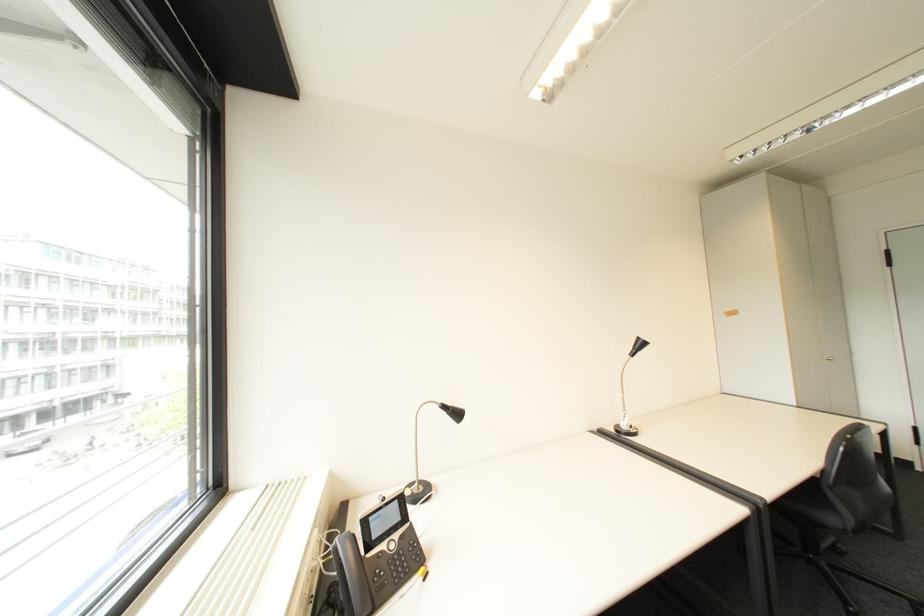
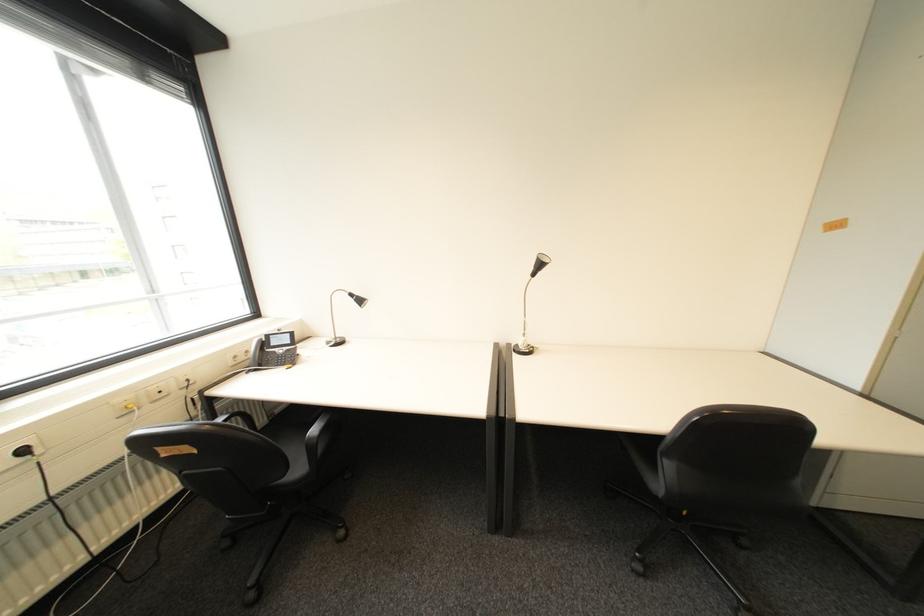
Question: I am providing you with two images of the same scene from different viewpoints. After the viewpoint changes to image2, which objects are now occluded?

Choices:
 (A) black chair armrest
 (B) black power plug
 (C) phone handset
 (D) none of these

Answer: (D)